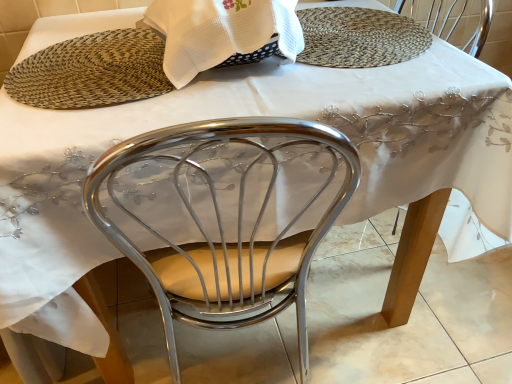
Identify the location of free space in front of white woven cloth at upper center. (220, 106).